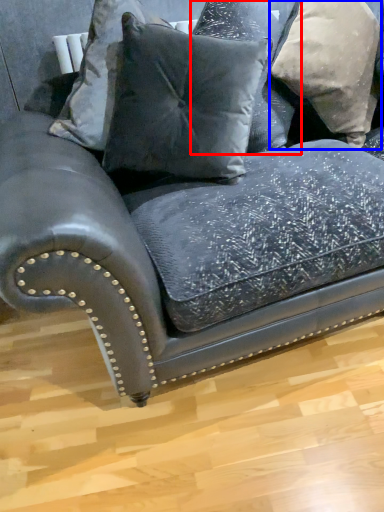
Question: Which point is closer to the camera, pillow (highlighted by a red box) or pillow (highlighted by a blue box)?

Choices:
 (A) pillow
 (B) pillow

Answer: (A)